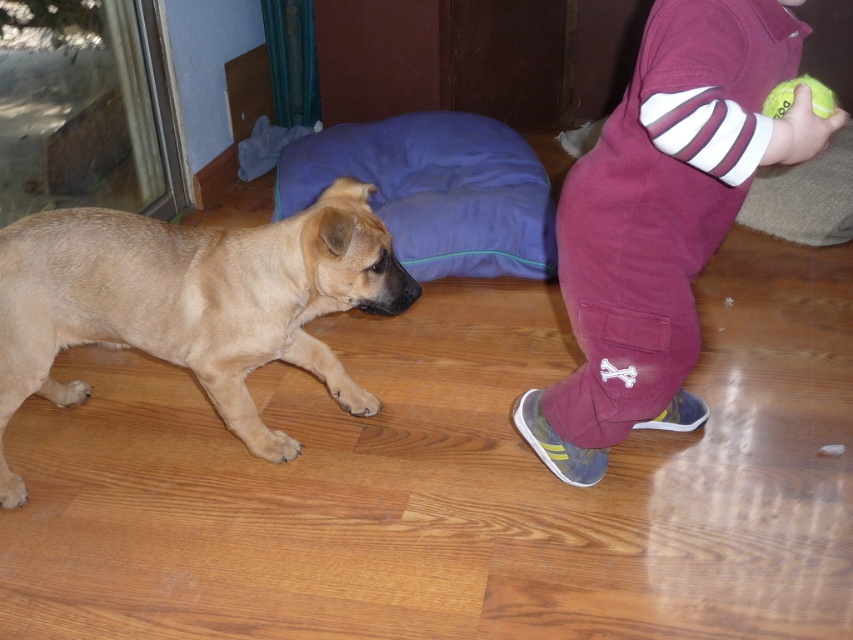
You are a robot trying to determine if the light brown fur at left can be distinguished from the yellow rubber tennis ball at lower right based on their heights. According to the scene, which one is taller?

The light brown fur at left is taller than the yellow rubber tennis ball at lower right.

Consider the image. You are standing in the room and want to pick up the tennis ball first before reaching the dog. Which point should you move toward first, point (114, 304) or point (378, 144)?

You should move toward point (114, 304) first because it is closer to you than point (378, 144).

You are a robot trying to pick up the light brown fur at left and the yellow rubber tennis ball at lower right. Which object requires more force to lift?

The light brown fur at left requires more force to lift because it is bigger than the yellow rubber tennis ball at lower right.